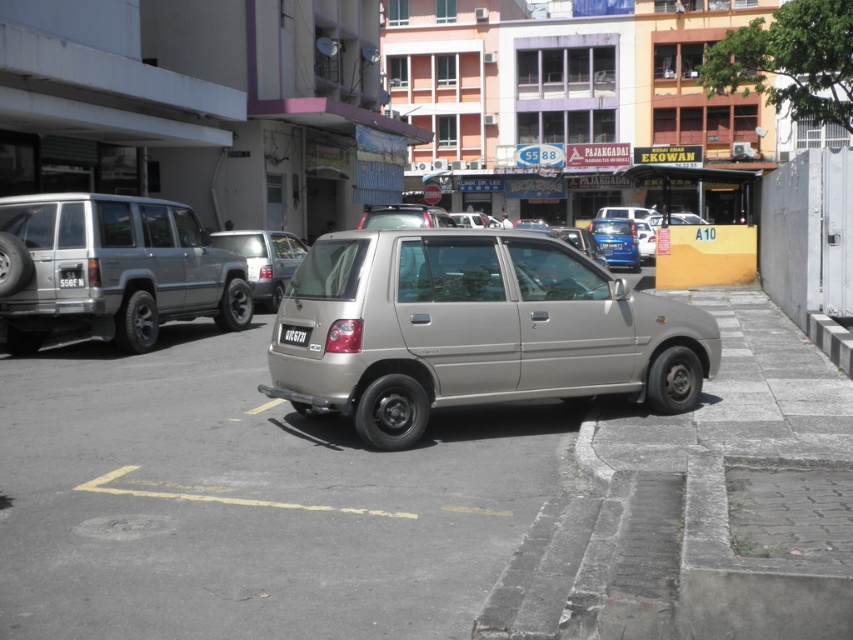
Question: Does satin silver suv at center have a lesser width compared to black plastic license plate at center?

Choices:
 (A) no
 (B) yes

Answer: (A)

Question: Which object is positioned closest to the black plastic license plate at center?

Choices:
 (A) satin silver suv at center
 (B) satin silver car at center
 (C) satin silver minivan at left

Answer: (B)

Question: Which is nearer to the black plastic license plate at center?

Choices:
 (A) satin silver minivan at left
 (B) satin silver suv at center

Answer: (A)

Question: Can you confirm if satin silver car at center is bigger than satin silver suv at center?

Choices:
 (A) yes
 (B) no

Answer: (A)

Question: Is satin silver car at center positioned behind satin silver suv at center?

Choices:
 (A) yes
 (B) no

Answer: (B)

Question: Which of the following is the farthest from the observer?

Choices:
 (A) (706, 348)
 (B) (288, 250)
 (C) (216, 305)

Answer: (B)